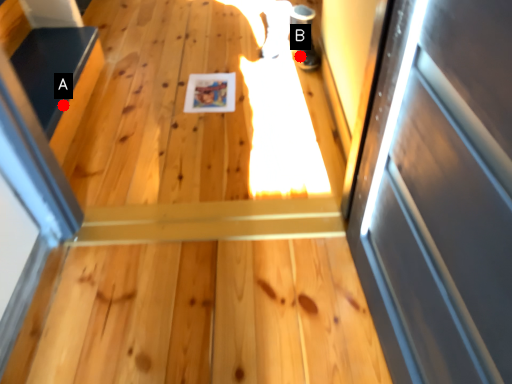
Question: Two points are circled on the image, labeled by A and B beside each circle. Which point is farther from the camera taking this photo?

Choices:
 (A) A is further
 (B) B is further

Answer: (B)